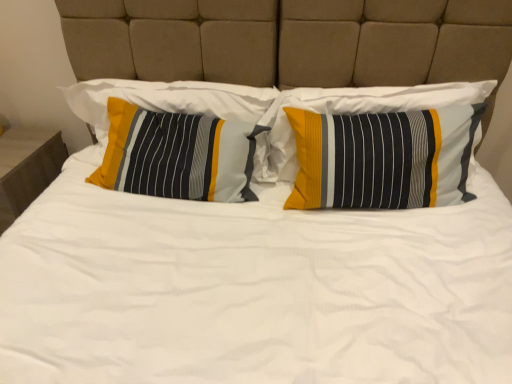
What is the approximate height of textured striped pillow at left, the 2th pillow positioned from the right?

The height of textured striped pillow at left, the 2th pillow positioned from the right, is 25.24 centimeters.

How much space does textured cotton pillow at center, placed as the 1th pillow when sorted from right to left, occupy vertically?

It is 14.18 inches.

Locate an element on the screen. matte wood nightstand at left is located at coordinates (27, 168).

Does matte wood nightstand at left turn towards textured cotton pillow at center, placed as the 1th pillow when sorted from right to left?

No, matte wood nightstand at left is not turned towards textured cotton pillow at center, placed as the 1th pillow when sorted from right to left.

Considering the sizes of matte wood nightstand at left and textured cotton pillow at center, placed as the 1th pillow when sorted from right to left, in the image, is matte wood nightstand at left wider or thinner than textured cotton pillow at center, placed as the 1th pillow when sorted from right to left,?

In the image, matte wood nightstand at left appears to be wider than textured cotton pillow at center, placed as the 1th pillow when sorted from right to left.

Looking at this image, relative to textured cotton pillow at center, the third pillow positioned from the left, is matte wood nightstand at left in front or behind?

matte wood nightstand at left is positioned farther from the viewer than textured cotton pillow at center, the third pillow positioned from the left.

Consider the image. Considering the sizes of objects matte wood nightstand at left and textured cotton pillow at center, the third pillow positioned from the left, in the image provided, who is shorter, matte wood nightstand at left or textured cotton pillow at center, the third pillow positioned from the left,?

textured cotton pillow at center, the third pillow positioned from the left.

Consider the image. Looking at the image, does textured cotton pillow at center, the third pillow positioned from the left, seem bigger or smaller compared to textured striped pillow at left, marked as the 1th pillow in a left-to-right arrangement?

In the image, textured cotton pillow at center, the third pillow positioned from the left, appears to be larger than textured striped pillow at left, marked as the 1th pillow in a left-to-right arrangement.

Considering the relative sizes of textured cotton pillow at center, placed as the 1th pillow when sorted from right to left, and textured striped pillow at left, marked as the 1th pillow in a left-to-right arrangement, in the image provided, is textured cotton pillow at center, placed as the 1th pillow when sorted from right to left, shorter than textured striped pillow at left, marked as the 1th pillow in a left-to-right arrangement,?

In fact, textured cotton pillow at center, placed as the 1th pillow when sorted from right to left, may be taller than textured striped pillow at left, marked as the 1th pillow in a left-to-right arrangement.

Which object is further away from the camera taking this photo, textured cotton pillow at center, the third pillow positioned from the left, or textured striped pillow at left, the 3th pillow from the right?

textured striped pillow at left, the 3th pillow from the right.

Is textured cotton pillow at center, placed as the 1th pillow when sorted from right to left, facing towards textured striped pillow at left, the 3th pillow from the right?

No, textured cotton pillow at center, placed as the 1th pillow when sorted from right to left, is not turned towards textured striped pillow at left, the 3th pillow from the right.

Is textured striped pillow at left, the 3th pillow from the right, taller than textured cotton pillow at center, the third pillow positioned from the left?

No.

From the picture: Can you tell me how much textured striped pillow at left, marked as the 1th pillow in a left-to-right arrangement, and textured cotton pillow at center, the third pillow positioned from the left, differ in facing direction?

They differ by 0.912 degrees in their facing directions.

Is textured striped pillow at left, marked as the 1th pillow in a left-to-right arrangement, next to textured cotton pillow at center, placed as the 1th pillow when sorted from right to left?

textured striped pillow at left, marked as the 1th pillow in a left-to-right arrangement, and textured cotton pillow at center, placed as the 1th pillow when sorted from right to left, are not in contact.

Does textured striped pillow at left, marked as the 1th pillow in a left-to-right arrangement, appear on the left side of textured cotton pillow at center, placed as the 1th pillow when sorted from right to left?

Yes, textured striped pillow at left, marked as the 1th pillow in a left-to-right arrangement, is to the left of textured cotton pillow at center, placed as the 1th pillow when sorted from right to left.

Looking at this image, is textured striped pillow at left, marked as the 1th pillow in a left-to-right arrangement, next to textured striped pillow at left, which is the 2th pillow from left to right, and touching it?

No, textured striped pillow at left, marked as the 1th pillow in a left-to-right arrangement, is not with textured striped pillow at left, which is the 2th pillow from left to right.

From the picture: Relative to textured striped pillow at left, which is the 2th pillow from left to right, is textured striped pillow at left, the 3th pillow from the right, in front or behind?

Visually, textured striped pillow at left, the 3th pillow from the right, is located behind textured striped pillow at left, which is the 2th pillow from left to right.

Considering the relative positions of textured striped pillow at left, marked as the 1th pillow in a left-to-right arrangement, and textured striped pillow at left, which is the 2th pillow from left to right, in the image provided, is textured striped pillow at left, marked as the 1th pillow in a left-to-right arrangement, to the right of textured striped pillow at left, which is the 2th pillow from left to right, from the viewer's perspective?

In fact, textured striped pillow at left, marked as the 1th pillow in a left-to-right arrangement, is to the left of textured striped pillow at left, which is the 2th pillow from left to right.

Based on the photo, can you confirm if textured cotton pillow at center, placed as the 1th pillow when sorted from right to left, is taller than textured striped pillow at left, which is the 2th pillow from left to right?

Correct, textured cotton pillow at center, placed as the 1th pillow when sorted from right to left, is much taller as textured striped pillow at left, which is the 2th pillow from left to right.

Is textured striped pillow at left, which is the 2th pillow from left to right, at the back of textured cotton pillow at center, placed as the 1th pillow when sorted from right to left?

No, textured striped pillow at left, which is the 2th pillow from left to right, is not at the back of textured cotton pillow at center, placed as the 1th pillow when sorted from right to left.

Considering the relative positions of textured cotton pillow at center, the third pillow positioned from the left, and textured striped pillow at left, the 2th pillow positioned from the right, in the image provided, is textured cotton pillow at center, the third pillow positioned from the left, in front of textured striped pillow at left, the 2th pillow positioned from the right,?

No.

In the scene shown: Is textured cotton pillow at center, placed as the 1th pillow when sorted from right to left, wider or thinner than textured striped pillow at left, which is the 2th pillow from left to right?

Considering their sizes, textured cotton pillow at center, placed as the 1th pillow when sorted from right to left, looks slimmer than textured striped pillow at left, which is the 2th pillow from left to right.

Where is `the 2nd pillow to the right of the matte wood nightstand at left, starting your count from the anchor`? the 2nd pillow to the right of the matte wood nightstand at left, starting your count from the anchor is located at coordinates (177, 155).

Which object is further away from the camera taking this photo, textured striped pillow at left, the 2th pillow positioned from the right, or matte wood nightstand at left?

matte wood nightstand at left is further from the camera.

From their relative heights in the image, would you say textured striped pillow at left, the 2th pillow positioned from the right, is taller or shorter than matte wood nightstand at left?

Considering their sizes, textured striped pillow at left, the 2th pillow positioned from the right, has less height than matte wood nightstand at left.

Can you tell me how much textured striped pillow at left, the 2th pillow positioned from the right, and matte wood nightstand at left differ in facing direction?

They differ by 4.76 degrees in their facing directions.

Is matte wood nightstand at left not near textured striped pillow at left, which is the 2th pillow from left to right?

matte wood nightstand at left is near textured striped pillow at left, which is the 2th pillow from left to right, not far away.

Is matte wood nightstand at left looking in the opposite direction of textured striped pillow at left, which is the 2th pillow from left to right?

No.

Who is more distant, matte wood nightstand at left or textured striped pillow at left, the 2th pillow positioned from the right?

matte wood nightstand at left is further from the camera.

Considering the positions of point (22, 204) and point (233, 136), is point (22, 204) closer or farther from the camera than point (233, 136)?

Point (22, 204) is positioned farther from the camera compared to point (233, 136).

Find the location of a particular element. This screenshot has height=384, width=512. nightstand behind the textured cotton pillow at center, the third pillow positioned from the left is located at coordinates (27, 168).

There is a textured striped pillow at left, the 3th pillow from the right. Identify the location of the 1st pillow below it (from a real-world perspective). Image resolution: width=512 pixels, height=384 pixels. (343, 113).

Based on their spatial positions, is textured striped pillow at left, marked as the 1th pillow in a left-to-right arrangement, or textured cotton pillow at center, placed as the 1th pillow when sorted from right to left, further from matte wood nightstand at left?

textured cotton pillow at center, placed as the 1th pillow when sorted from right to left.

Which object lies nearer to the anchor point matte wood nightstand at left, textured cotton pillow at center, the third pillow positioned from the left, or textured striped pillow at left, marked as the 1th pillow in a left-to-right arrangement?

textured striped pillow at left, marked as the 1th pillow in a left-to-right arrangement.

When comparing their distances from matte wood nightstand at left, does textured striped pillow at left, the 2th pillow positioned from the right, or textured striped pillow at left, marked as the 1th pillow in a left-to-right arrangement, seem closer?

textured striped pillow at left, marked as the 1th pillow in a left-to-right arrangement, is positioned closer to the anchor matte wood nightstand at left.

Estimate the real-world distances between objects in this image. Which object is closer to matte wood nightstand at left, textured cotton pillow at center, the third pillow positioned from the left, or textured striped pillow at left, which is the 2th pillow from left to right?

textured striped pillow at left, which is the 2th pillow from left to right, is closer to matte wood nightstand at left.

Looking at this image, from the image, which object appears to be nearer to textured striped pillow at left, which is the 2th pillow from left to right, textured striped pillow at left, marked as the 1th pillow in a left-to-right arrangement, or textured cotton pillow at center, placed as the 1th pillow when sorted from right to left?

textured striped pillow at left, marked as the 1th pillow in a left-to-right arrangement, lies closer to textured striped pillow at left, which is the 2th pillow from left to right, than the other object.

Based on their spatial positions, is matte wood nightstand at left or textured striped pillow at left, marked as the 1th pillow in a left-to-right arrangement, closer to textured striped pillow at left, which is the 2th pillow from left to right?

Based on the image, textured striped pillow at left, marked as the 1th pillow in a left-to-right arrangement, appears to be nearer to textured striped pillow at left, which is the 2th pillow from left to right.

From the image, which object appears to be farther from textured cotton pillow at center, the third pillow positioned from the left, matte wood nightstand at left or textured striped pillow at left, marked as the 1th pillow in a left-to-right arrangement?

matte wood nightstand at left.

From the picture: When comparing their distances from textured striped pillow at left, which is the 2th pillow from left to right, does textured striped pillow at left, the 3th pillow from the right, or matte wood nightstand at left seem closer?

textured striped pillow at left, the 3th pillow from the right, lies closer to textured striped pillow at left, which is the 2th pillow from left to right, than the other object.

I want to click on pillow between textured striped pillow at left, the 3th pillow from the right, and textured cotton pillow at center, placed as the 1th pillow when sorted from right to left, so click(177, 155).

At what (x,y) coordinates should I click in order to perform the action: click on pillow between matte wood nightstand at left and textured striped pillow at left, the 2th pillow positioned from the right. Please return your answer as a coordinate pair (x, y). Looking at the image, I should click on (167, 100).